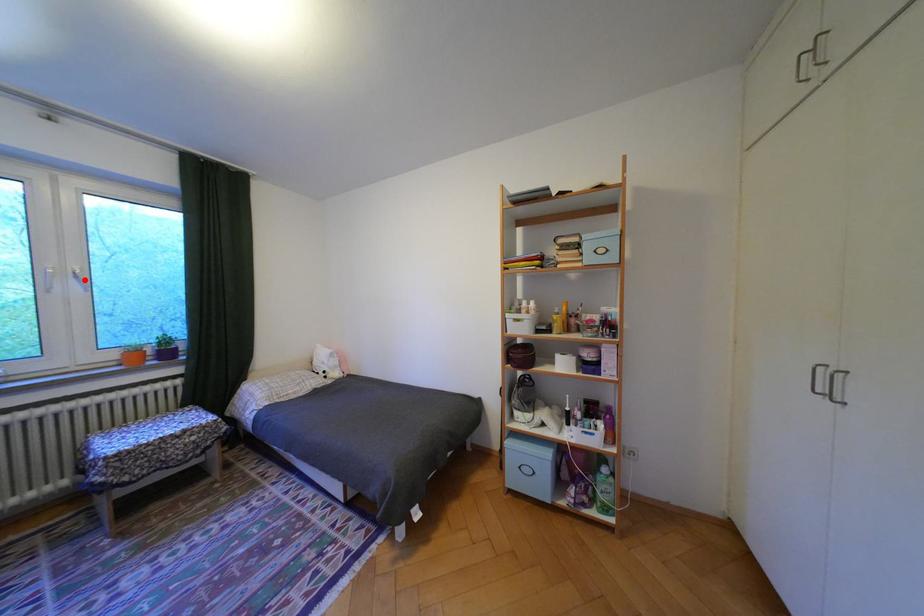
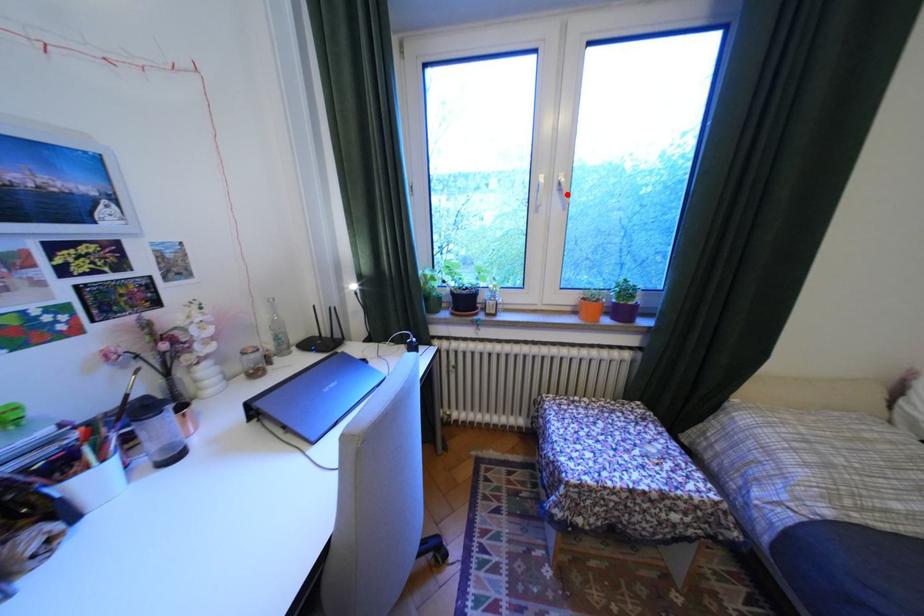
I am providing you with two images of the same scene from different viewpoints. A red point is marked on the first image and another point is marked on the second image. Does the point marked in image1 correspond to the same location as the one in image2?

Yes